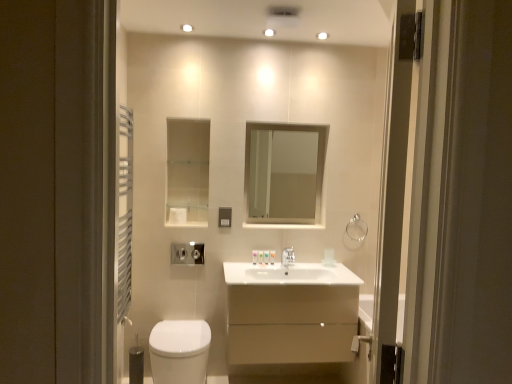
This screenshot has width=512, height=384. I want to click on vacant area on top of white glossy toilet at lower left (from a real-world perspective), so pos(178,329).